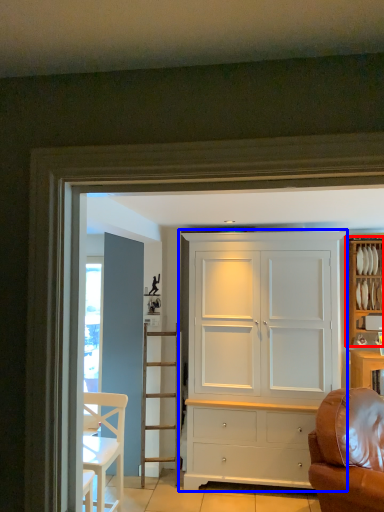
Question: Which object is closer to the camera taking this photo, cabinetry (highlighted by a red box) or cupboard (highlighted by a blue box)?

Choices:
 (A) cabinetry
 (B) cupboard

Answer: (B)